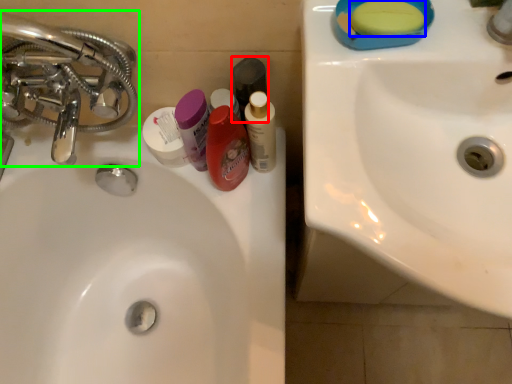
Question: Which object is the closest to the mouthwash (highlighted by a red box)? Choose among these: soap (highlighted by a blue box) or tap (highlighted by a green box).

Choices:
 (A) soap
 (B) tap

Answer: (A)